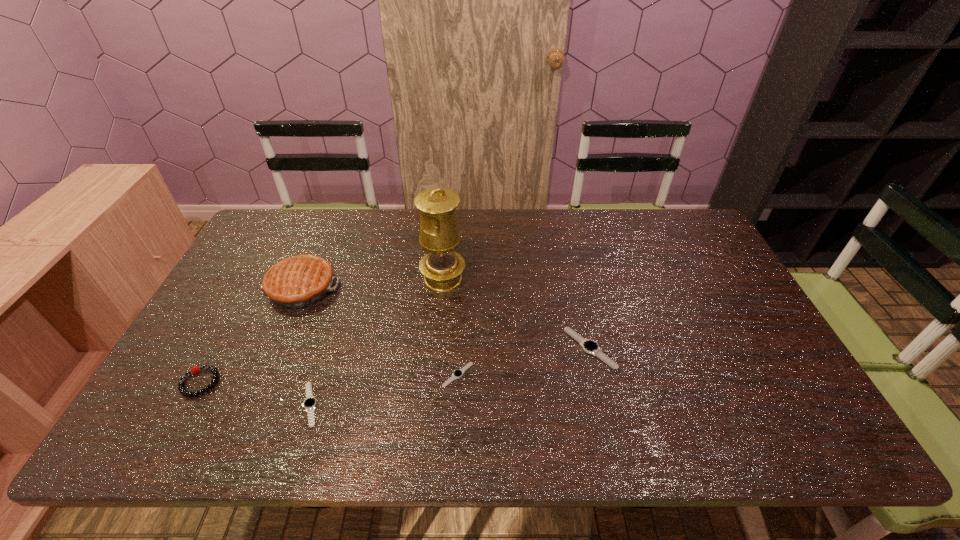
Where is `vacant spot to place a watch on the right`? vacant spot to place a watch on the right is located at coordinates (709, 324).